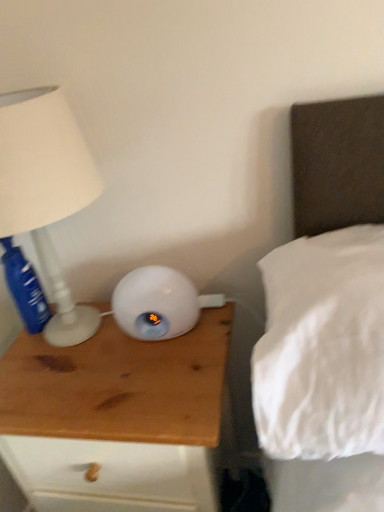
Question: Does white matte lamp at left have a greater height compared to wooden nightstand at left?

Choices:
 (A) no
 (B) yes

Answer: (A)

Question: From a real-world perspective, is white matte lamp at left below wooden nightstand at left?

Choices:
 (A) yes
 (B) no

Answer: (B)

Question: Is white matte lamp at left positioned beyond the bounds of wooden nightstand at left?

Choices:
 (A) yes
 (B) no

Answer: (A)

Question: Would you say white matte lamp at left contains wooden nightstand at left?

Choices:
 (A) yes
 (B) no

Answer: (B)

Question: Does white matte lamp at left have a smaller size compared to wooden nightstand at left?

Choices:
 (A) yes
 (B) no

Answer: (A)

Question: Is point (307, 174) positioned closer to the camera than point (193, 506)?

Choices:
 (A) farther
 (B) closer

Answer: (B)

Question: Visually, is white soft pillow at upper right positioned to the left or to the right of wooden nightstand at left?

Choices:
 (A) left
 (B) right

Answer: (B)

Question: In terms of height, does white soft pillow at upper right look taller or shorter compared to wooden nightstand at left?

Choices:
 (A) tall
 (B) short

Answer: (B)

Question: Is white soft pillow at upper right inside or outside of wooden nightstand at left?

Choices:
 (A) inside
 (B) outside

Answer: (B)

Question: From their relative heights in the image, would you say white matte lamp at left is taller or shorter than wooden nightstand at left?

Choices:
 (A) tall
 (B) short

Answer: (B)

Question: In the image, is white matte lamp at left on the left side or the right side of wooden nightstand at left?

Choices:
 (A) left
 (B) right

Answer: (A)

Question: Is point (x=33, y=229) positioned closer to the camera than point (x=172, y=392)?

Choices:
 (A) closer
 (B) farther

Answer: (B)

Question: In the image, is white matte lamp at left positioned in front of or behind wooden nightstand at left?

Choices:
 (A) behind
 (B) front

Answer: (B)

Question: Considering the relative positions of white matte lamp at left and blue plastic bottle at left in the image provided, is white matte lamp at left to the left or to the right of blue plastic bottle at left?

Choices:
 (A) left
 (B) right

Answer: (B)

Question: From a real-world perspective, is white matte lamp at left physically located above or below blue plastic bottle at left?

Choices:
 (A) above
 (B) below

Answer: (A)